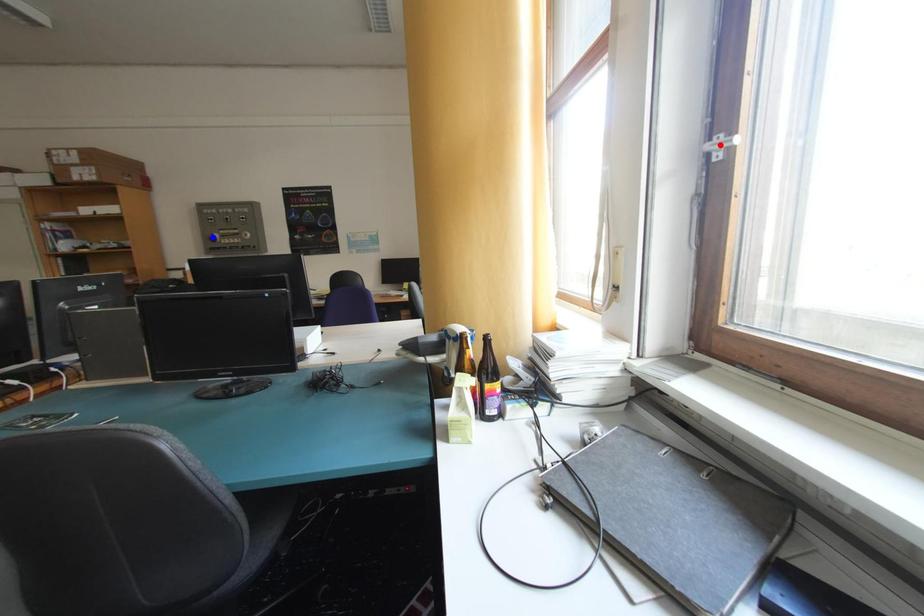
Question: Which of the two points in the image is closer to the camera?

Choices:
 (A) Blue point is closer.
 (B) Red point is closer.

Answer: (B)